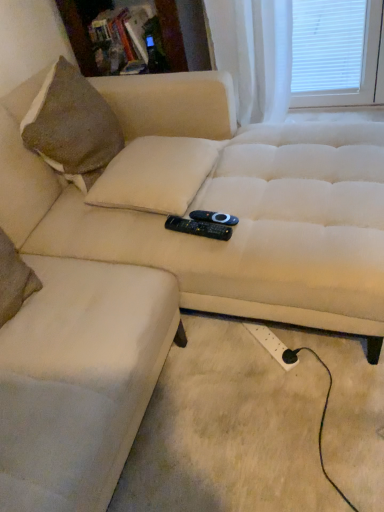
Locate an element on the screen. vacant area to the right of white plastic extension cord at lower right is located at coordinates (311, 347).